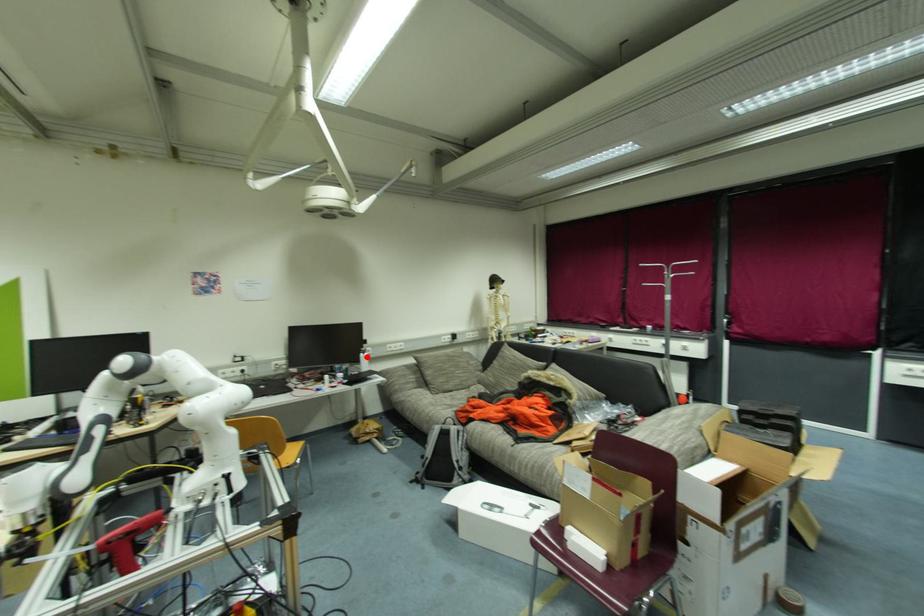
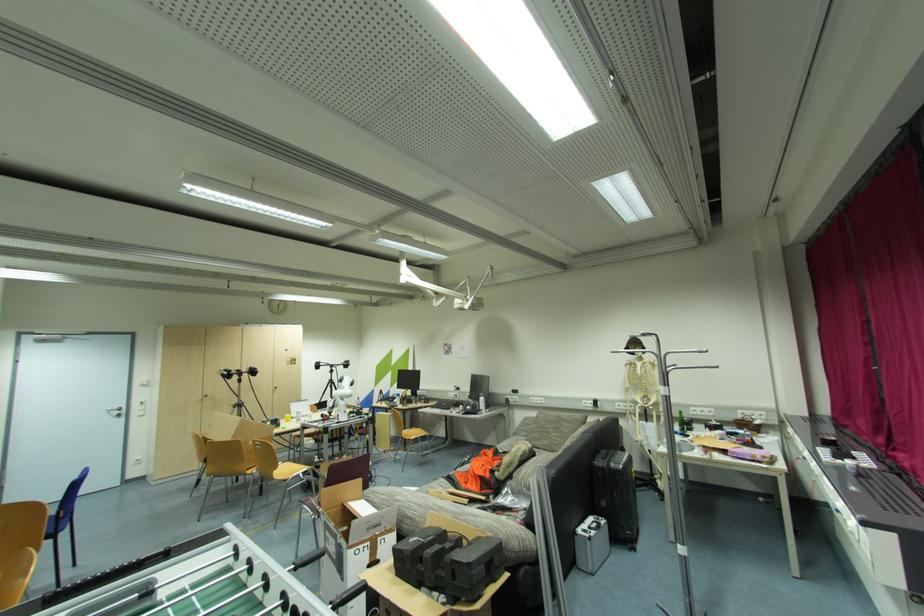
Find the pixel in the second image that matches the highlighted location in the first image.

(484, 400)